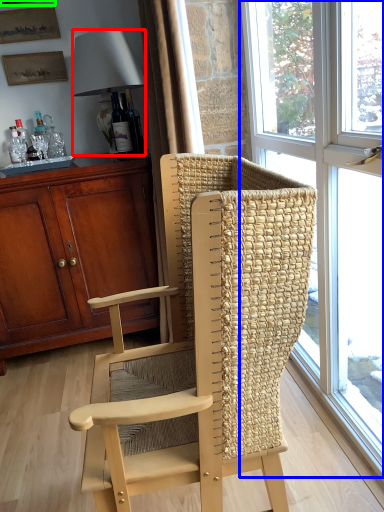
Question: Which is nearer to the lamp (highlighted by a red box)? window (highlighted by a blue box) or picture frame (highlighted by a green box).

Choices:
 (A) window
 (B) picture frame

Answer: (B)